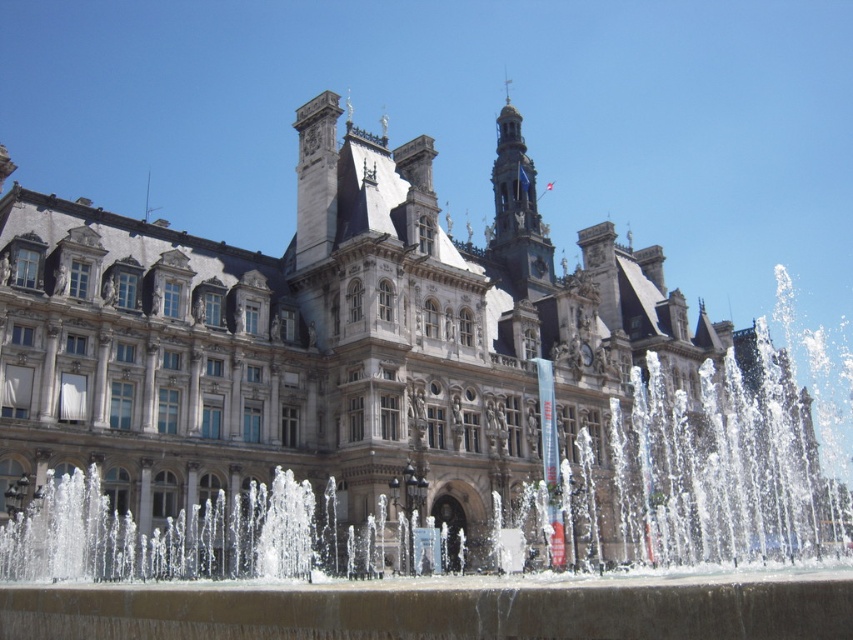
Question: Is clear water at center thinner than gray stone tower at upper center?

Choices:
 (A) no
 (B) yes

Answer: (A)

Question: Which object is farther from the camera taking this photo?

Choices:
 (A) clear water at center
 (B) gray stone tower at upper center

Answer: (B)

Question: Can you confirm if clear water at center is positioned below gray stone tower at upper center?

Choices:
 (A) no
 (B) yes

Answer: (B)

Question: Can you confirm if clear water at center is bigger than gray stone tower at upper center?

Choices:
 (A) no
 (B) yes

Answer: (B)